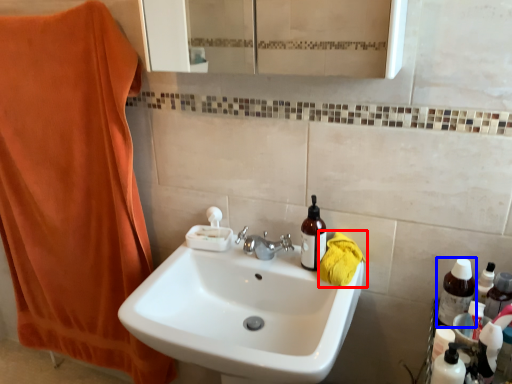
Question: Which of the following is the farthest to the observer, beach towel (highlighted by a red box) or bottle (highlighted by a blue box)?

Choices:
 (A) beach towel
 (B) bottle

Answer: (A)